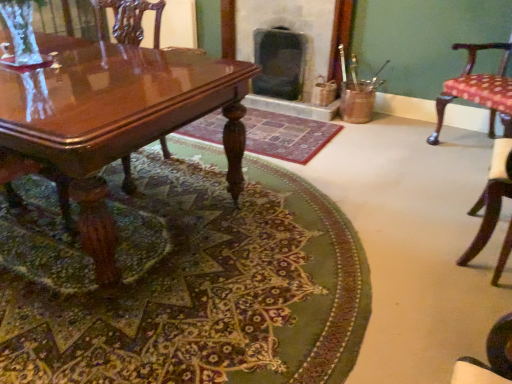
Question: Considering the positions of point tap(476, 76) and point tap(11, 190), is point tap(476, 76) closer or farther from the camera than point tap(11, 190)?

Choices:
 (A) closer
 (B) farther

Answer: (B)

Question: Is polka dot fabric chair at right, the first chair positioned from the right, wider or thinner than glossy wood chair at left, the third chair from the right?

Choices:
 (A) thin
 (B) wide

Answer: (A)

Question: Which is nearer to the glossy wood chair at left, the third chair from the right?

Choices:
 (A) glossy wood coffee table at lower left
 (B) green woven rug at center, placed as the first mat when sorted from back to front
 (C) dark gray stone fireplace at center, the first fireplace when ordered from left to right
 (D) patterned fabric cushion at right, which is the 2th chair from right to left
 (E) polka dot fabric chair at right, the first chair positioned from the right

Answer: (A)

Question: Which object is positioned farthest from the green woven rug at center, positioned as the 2th mat in front-to-back order?

Choices:
 (A) carpeted floor at center, placed as the 2th mat when sorted from back to front
 (B) patterned fabric cushion at right, which is the 2th chair from right to left
 (C) glossy wood chair at left, the third chair from the right
 (D) glossy wood coffee table at lower left
 (E) dark gray stone fireplace at center, the first fireplace when ordered from left to right

Answer: (C)